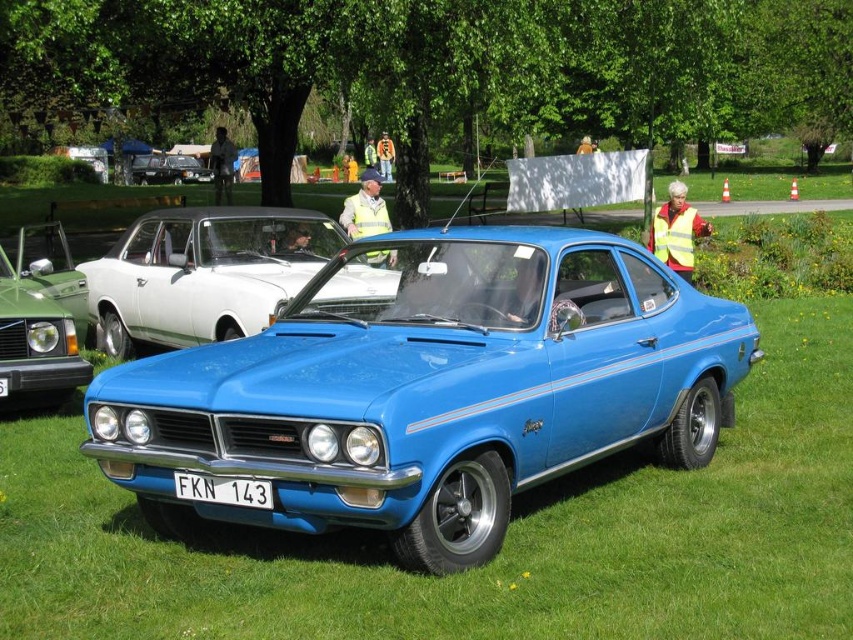
Is glossy blue car at center below shiny black car at center?

Correct, glossy blue car at center is located below shiny black car at center.

Which of these two, glossy blue car at center or shiny black car at center, stands shorter?

Standing shorter between the two is shiny black car at center.

Image resolution: width=853 pixels, height=640 pixels. What do you see at coordinates (431, 388) in the screenshot?
I see `glossy blue car at center` at bounding box center [431, 388].

I want to click on glossy blue car at center, so click(x=431, y=388).

Which is more to the right, glossy blue car at center or green matte car at left?

Positioned to the right is glossy blue car at center.

Can you confirm if glossy blue car at center is wider than green matte car at left?

Yes, glossy blue car at center is wider than green matte car at left.

The height and width of the screenshot is (640, 853). In order to click on glossy blue car at center in this screenshot , I will do `click(431, 388)`.

Identify the location of glossy blue car at center. (431, 388).

Does point (55, 392) lie behind point (163, 160)?

That is False.

Is green matte car at left wider than shiny black car at center?

Yes, green matte car at left is wider than shiny black car at center.

Find the location of a particular element. This screenshot has height=640, width=853. green matte car at left is located at coordinates (35, 344).

Where is `green matte car at left`? Image resolution: width=853 pixels, height=640 pixels. green matte car at left is located at coordinates (35, 344).